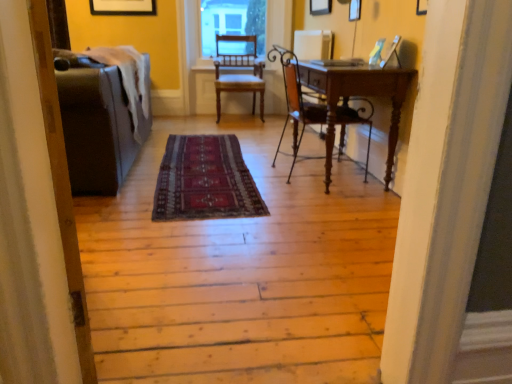
Question: From the image's perspective, is matte gray couch at left over wooden chair at center, the first chair from the left?

Choices:
 (A) yes
 (B) no

Answer: (B)

Question: Does matte gray couch at left have a lesser width compared to wooden chair at center, arranged as the second chair when ordered from the bottom?

Choices:
 (A) yes
 (B) no

Answer: (B)

Question: Is matte gray couch at left beside wooden chair at center, the first chair from the left?

Choices:
 (A) yes
 (B) no

Answer: (B)

Question: Is matte gray couch at left oriented towards wooden chair at center, which is the first chair from back to front?

Choices:
 (A) yes
 (B) no

Answer: (B)

Question: From a real-world perspective, is matte gray couch at left under wooden chair at center, arranged as the second chair when viewed from the front?

Choices:
 (A) no
 (B) yes

Answer: (B)

Question: From a real-world perspective, relative to clear glass window screen at upper center, is wooden chair at center, arranged as the second chair when viewed from the front, vertically above or below?

Choices:
 (A) below
 (B) above

Answer: (A)

Question: Is point (254, 61) positioned closer to the camera than point (221, 1)?

Choices:
 (A) closer
 (B) farther

Answer: (A)

Question: From the image's perspective, is wooden chair at center, the first chair from the left, positioned above or below clear glass window screen at upper center?

Choices:
 (A) below
 (B) above

Answer: (A)

Question: Looking at their shapes, would you say wooden chair at center, which ranks as the second chair in right-to-left order, is wider or thinner than clear glass window screen at upper center?

Choices:
 (A) wide
 (B) thin

Answer: (A)

Question: Is matte black couch at left spatially inside dark red woven rug at center, or outside of it?

Choices:
 (A) inside
 (B) outside

Answer: (B)

Question: From the image's perspective, is matte black couch at left above or below dark red woven rug at center?

Choices:
 (A) above
 (B) below

Answer: (B)

Question: From a real-world perspective, is matte black couch at left physically located above or below dark red woven rug at center?

Choices:
 (A) below
 (B) above

Answer: (B)

Question: Is point (69, 273) closer or farther from the camera than point (205, 155)?

Choices:
 (A) closer
 (B) farther

Answer: (A)

Question: From a real-world perspective, relative to matte gray couch at left, is wooden chair at center, arranged as the second chair when ordered from the bottom, vertically above or below?

Choices:
 (A) above
 (B) below

Answer: (A)

Question: Is wooden chair at center, the first chair positioned from the top, wider or thinner than matte gray couch at left?

Choices:
 (A) thin
 (B) wide

Answer: (A)